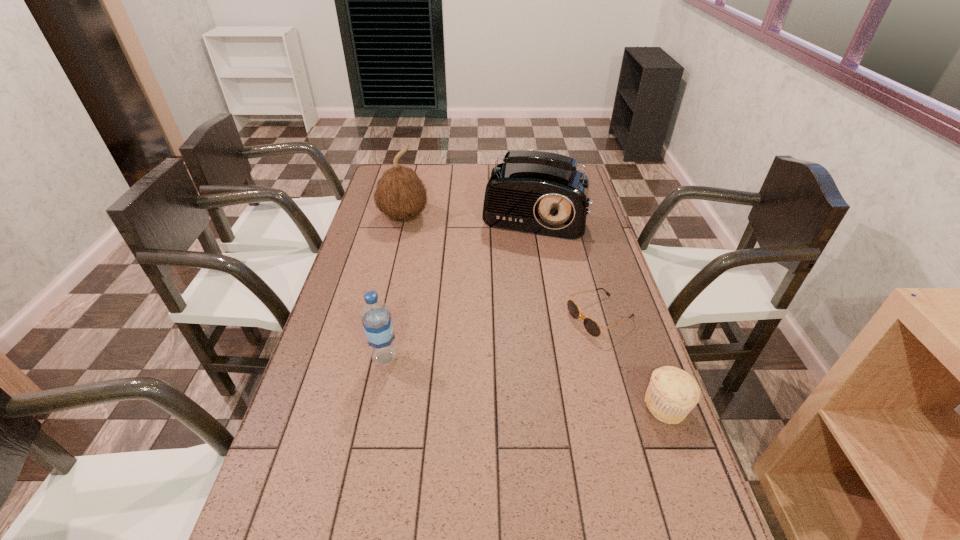
You are a GUI agent. You are given a task and a screenshot of the screen. Output one action in this format:
    pyautogui.click(x=<x>, y=<y>)
    Task: Click on the fourth closest object to the third shortest object
    This screenshot has width=960, height=540.
    Given the screenshot: What is the action you would take?
    [x=672, y=393]

Point out which object is positioned as the third nearest to the fourth tallest object. Please provide its 2D coordinates. Your answer should be formatted as a tuple, i.e. [(x, y)], where the tuple contains the x and y coordinates of a point satisfying the conditions above.

[(376, 318)]

The image size is (960, 540). I want to click on vacant point that satisfies the following two spatial constraints: 1. on the front side of the coconut; 2. on the right side of the second shortest object, so click(360, 406).

Where is `vacant space that satisfies the following two spatial constraints: 1. on the front side of the sunglasses; 2. on the right side of the coconut`? vacant space that satisfies the following two spatial constraints: 1. on the front side of the sunglasses; 2. on the right side of the coconut is located at coordinates pos(381,317).

Locate an element on the screen. vacant point that satisfies the following two spatial constraints: 1. on the front side of the fourth farthest object; 2. on the label of the coconut is located at coordinates (372, 358).